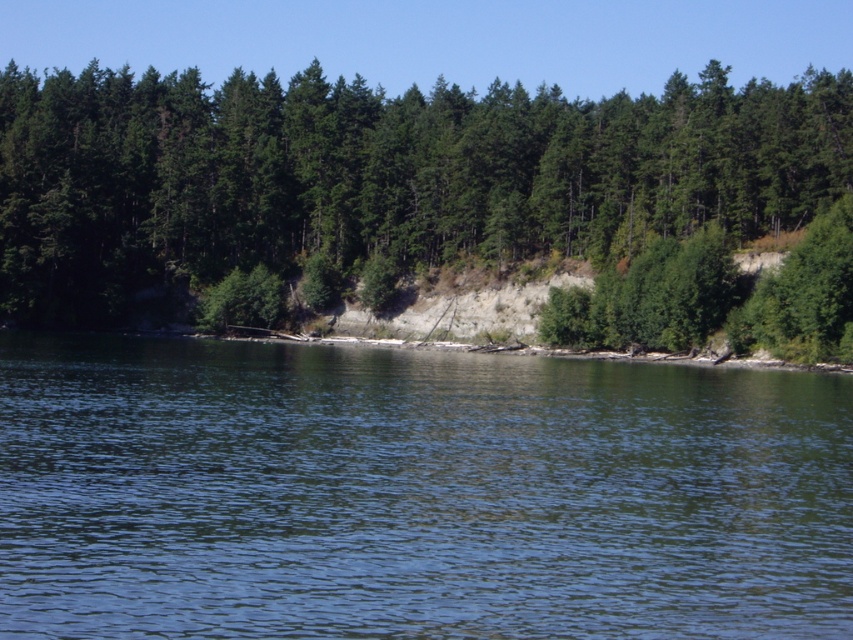
Who is higher up, clear water at center or green matte trees at upper center?

green matte trees at upper center

Does clear water at center appear over green matte trees at upper center?

No, clear water at center is not above green matte trees at upper center.

Is point (189, 400) farther from camera compared to point (402, 163)?

No.

Identify the location of clear water at center. (415, 493).